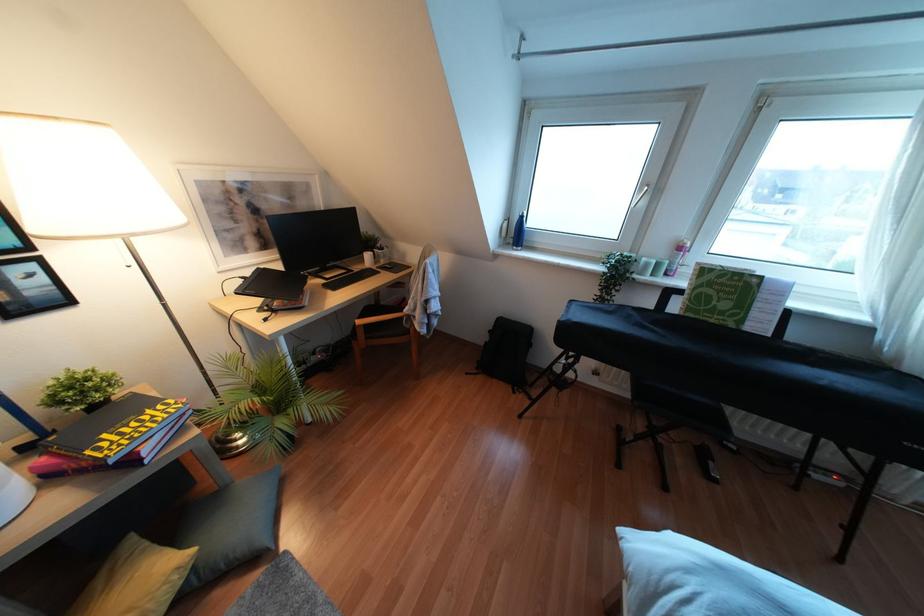
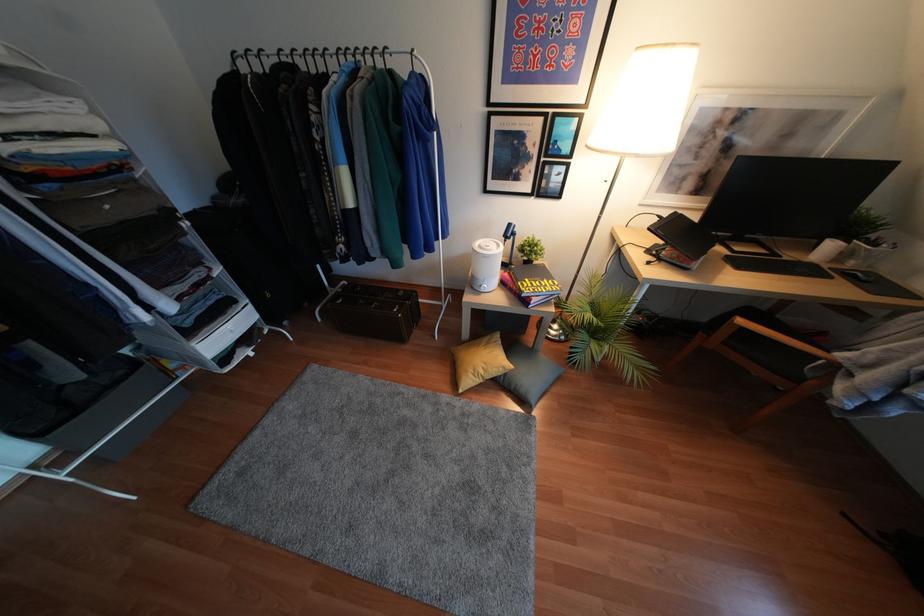
The point at (392, 265) is marked in the first image. Where is the corresponding point in the second image?

(868, 281)